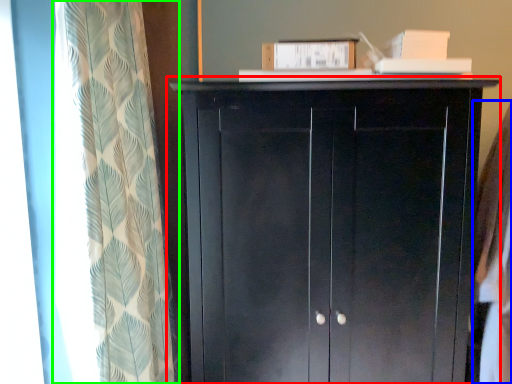
Question: Considering the real-world distances, which object is closest to cupboard (highlighted by a red box)? clothing (highlighted by a blue box) or curtain (highlighted by a green box).

Choices:
 (A) clothing
 (B) curtain

Answer: (B)